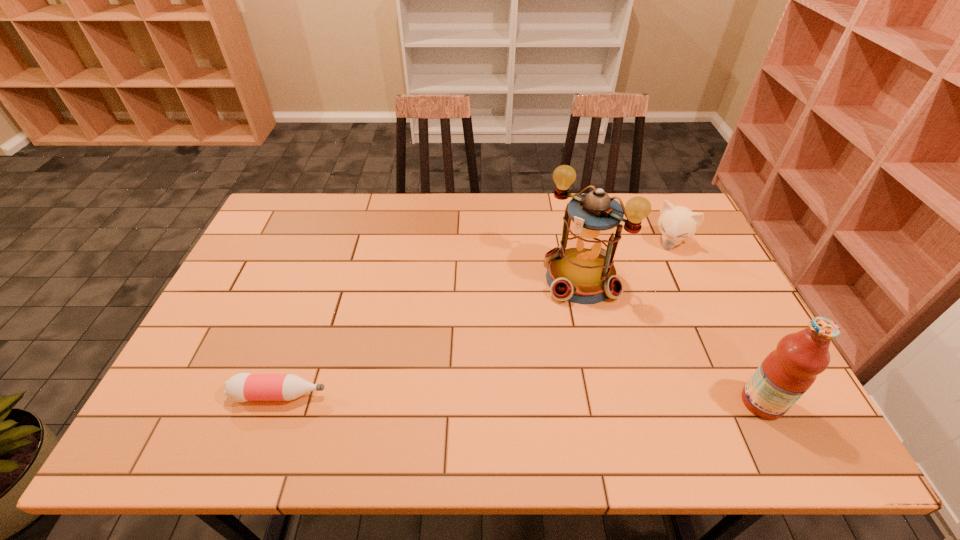
At what (x,y) coordinates should I click in order to perform the action: click on object situated at the far right corner. Please return your answer as a coordinate pair (x, y). The image size is (960, 540). Looking at the image, I should click on (677, 223).

This screenshot has width=960, height=540. Find the location of `object that is at the near right corner`. object that is at the near right corner is located at coordinates (787, 372).

At what (x,y) coordinates should I click in order to perform the action: click on free location at the far edge of the desktop. Please return your answer as a coordinate pair (x, y). The image size is (960, 540). Looking at the image, I should click on (431, 194).

Where is `free spot at the near edge of the desktop`? This screenshot has width=960, height=540. free spot at the near edge of the desktop is located at coordinates (399, 400).

You are a GUI agent. You are given a task and a screenshot of the screen. Output one action in this format:
    pyautogui.click(x=<x>, y=<y>)
    Task: Click on the free region at the left edge of the desktop
    
    Given the screenshot: What is the action you would take?
    pyautogui.click(x=284, y=263)

This screenshot has width=960, height=540. What are the coordinates of `free space at the right edge of the desktop` in the screenshot? It's located at (707, 245).

Where is `vacant region at the far left corner`? The width and height of the screenshot is (960, 540). vacant region at the far left corner is located at coordinates (314, 197).

In the image, there is a desktop. Identify the location of vacant space at the far right corner. (679, 203).

Locate an element on the screen. The width and height of the screenshot is (960, 540). vacant area that lies between the third shortest object and the tallest object is located at coordinates (671, 340).

In order to click on free area in between the third object from right to left and the second tallest object in this screenshot , I will do [671, 340].